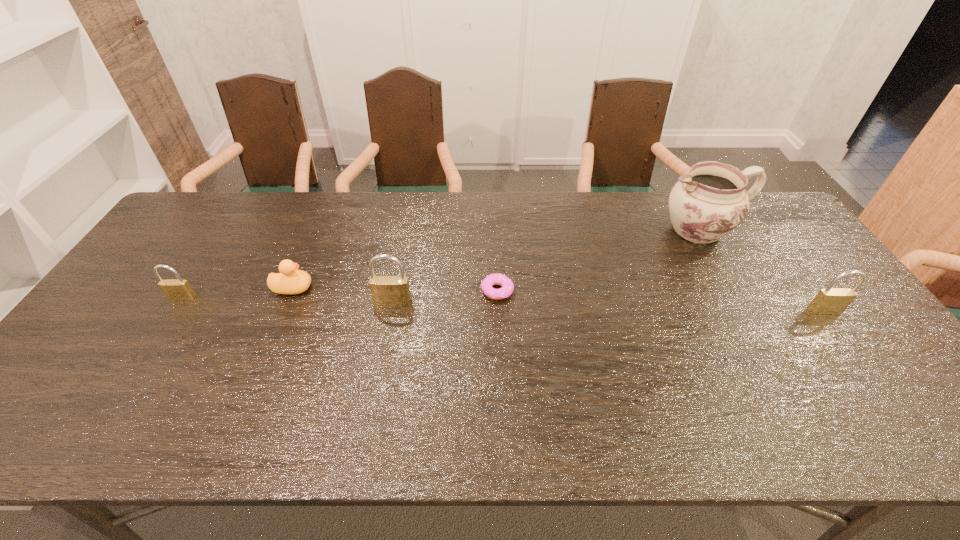
Identify the location of vacant area between the pitcher and the shortest object. (599, 260).

At what (x,y) coordinates should I click in order to perform the action: click on free space between the second shortest object and the rightmost padlock. Please return your answer as a coordinate pair (x, y). The image size is (960, 540). Looking at the image, I should click on (559, 299).

Find the location of `vacant space that's between the nearest object and the fourth object from right to left`. vacant space that's between the nearest object and the fourth object from right to left is located at coordinates (609, 306).

You are a GUI agent. You are given a task and a screenshot of the screen. Output one action in this format:
    pyautogui.click(x=<x>, y=<y>)
    Task: Click on the vacant area between the leftmost object and the fourth object from left to right
    
    Given the screenshot: What is the action you would take?
    pyautogui.click(x=340, y=294)

The height and width of the screenshot is (540, 960). In order to click on free space between the third object from left to right and the second object from left to right in this screenshot , I will do `click(343, 295)`.

At what (x,y) coordinates should I click in order to perform the action: click on empty space between the leftmost object and the second padlock from right to left. Please return your answer as a coordinate pair (x, y). The height and width of the screenshot is (540, 960). Looking at the image, I should click on (288, 300).

The width and height of the screenshot is (960, 540). What are the coordinates of `vacant area that lies between the nearest padlock and the fifth tallest object` in the screenshot? It's located at (559, 299).

Image resolution: width=960 pixels, height=540 pixels. In order to click on vacant space that's between the fourth shortest object and the second padlock from left to right in this screenshot , I will do point(609,306).

The width and height of the screenshot is (960, 540). I want to click on object that is the fourth closest to the third tallest object, so click(x=290, y=281).

Point out which object is positioned as the nearest to the second padlock from right to left. Please provide its 2D coordinates. Your answer should be formatted as a tuple, i.e. [(x, y)], where the tuple contains the x and y coordinates of a point satisfying the conditions above.

[(290, 281)]